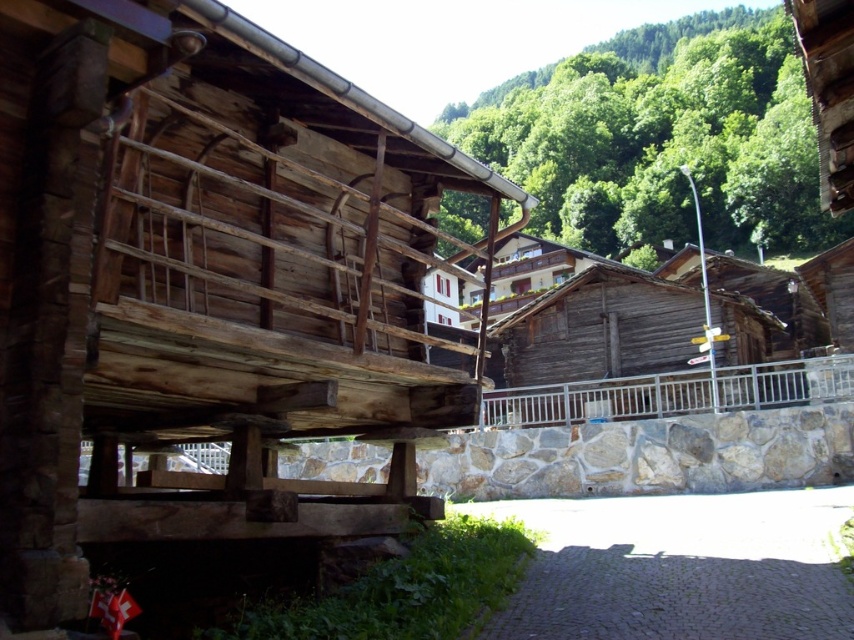
You are a traveler in this village and need to choose between two huts for shelter. The natural wood hut at center and the weathered wood hut at center. Which one is bigger?

The weathered wood hut at center is bigger than the natural wood hut at center.

You are standing in the village square and want to take a photo of the natural wood hut at center and the silver metallic balustrade at center. Which object should you focus on first if you want both to be in sharp focus?

To have both the natural wood hut at center and the silver metallic balustrade at center in sharp focus, focus on the natural wood hut at center first since it is closer to the viewer. This ensures the closer object is in focus, and the farther object may also be within the depth of field.

You are a visitor in this village and want to take a photo of the weathered wood hut at center and the silver metallic balustrade at center. Which object should you focus on first if you want to capture both in a single frame without moving the camera?

The weathered wood hut at center is much taller than the silver metallic balustrade at center, so you should focus on the weathered wood hut at center first to ensure it fits within the frame.